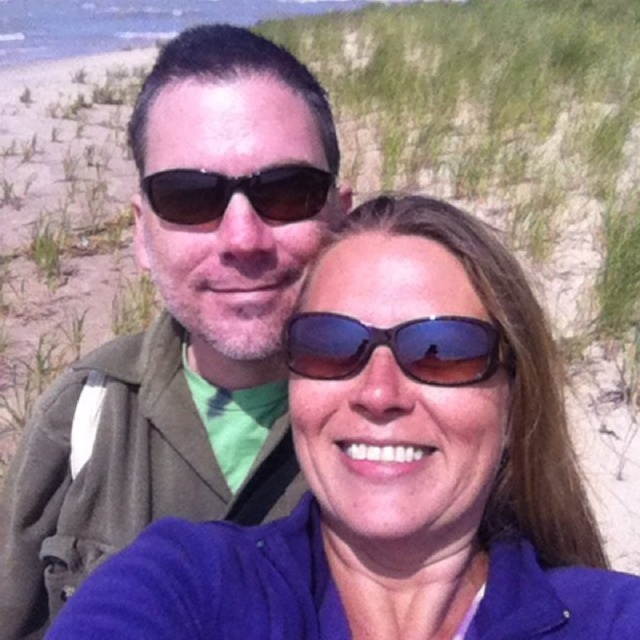
You are standing at the point marked as point (184, 324) in the image. What object is located exactly at your current position?

The matte green jacket at center is located exactly at point (184, 324).